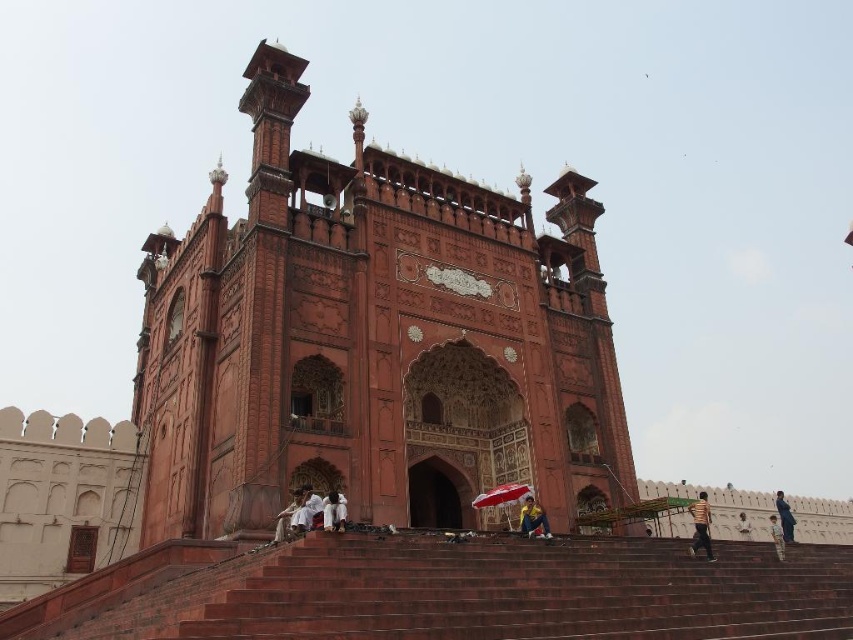
Question: Can you confirm if smooth stone stairs at center is positioned to the right of light blue fabric at lower right?

Choices:
 (A) no
 (B) yes

Answer: (A)

Question: Which point appears closest to the camera in this image?

Choices:
 (A) (296, 486)
 (B) (457, 461)
 (C) (527, 513)
 (D) (738, 522)

Answer: (A)

Question: Which object is the farthest from the white cotton shirt at lower center?

Choices:
 (A) light blue fabric at lower right
 (B) yellow striped shirt at lower right
 (C) smooth stone stairs at center
 (D) red fabric umbrella at center

Answer: (A)

Question: Does red sandstone palace at center appear on the right side of white cotton shirt at lower right?

Choices:
 (A) yes
 (B) no

Answer: (B)

Question: Estimate the real-world distances between objects in this image. Which object is farther from the smooth stone stairs at center?

Choices:
 (A) light blue fabric at lower right
 (B) yellow striped shirt at lower right
 (C) red sandstone palace at center
 (D) red fabric umbrella at center

Answer: (A)

Question: Does white cotton shirt at lower center have a lesser width compared to light brown fabric pants at lower right?

Choices:
 (A) yes
 (B) no

Answer: (A)